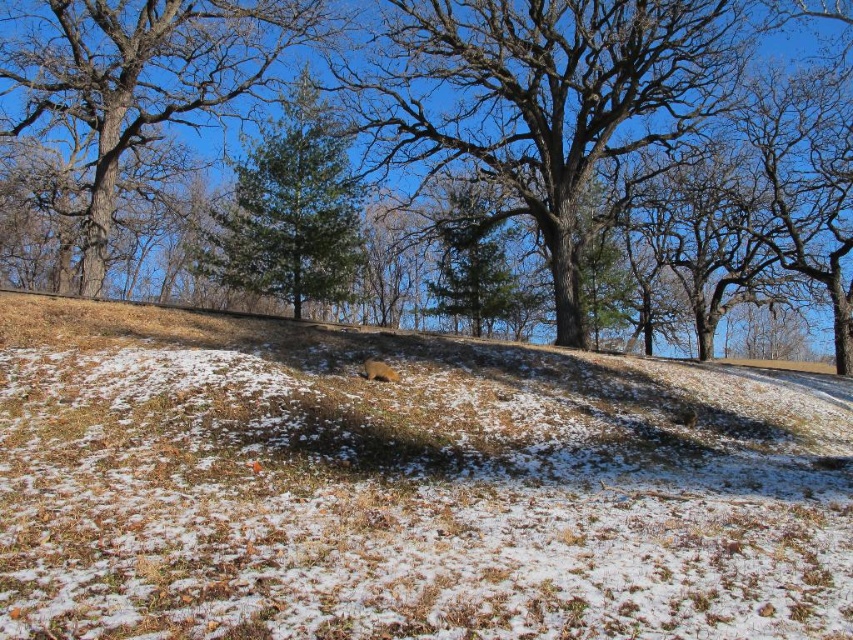
Question: Which object is closer to the camera taking this photo?

Choices:
 (A) brown textured tree at center
 (B) green needle-like at upper center
 (C) green pine tree at center
 (D) brown grass at center

Answer: (D)

Question: Does brown grass at center have a larger size compared to brown textured tree at center?

Choices:
 (A) yes
 (B) no

Answer: (B)

Question: From the image, what is the correct spatial relationship of brown grass at center in relation to brown textured tree at center?

Choices:
 (A) above
 (B) below

Answer: (B)

Question: Which point is closer to the camera?

Choices:
 (A) (831, 140)
 (B) (505, 397)

Answer: (B)

Question: Considering the relative positions of brown textured tree at center and green needle-like at upper center in the image provided, where is brown textured tree at center located with respect to green needle-like at upper center?

Choices:
 (A) below
 (B) above

Answer: (A)

Question: Which of the following is the closest to the observer?

Choices:
 (A) brown textured tree at center
 (B) green needle-like at upper center
 (C) brown grass at center

Answer: (C)